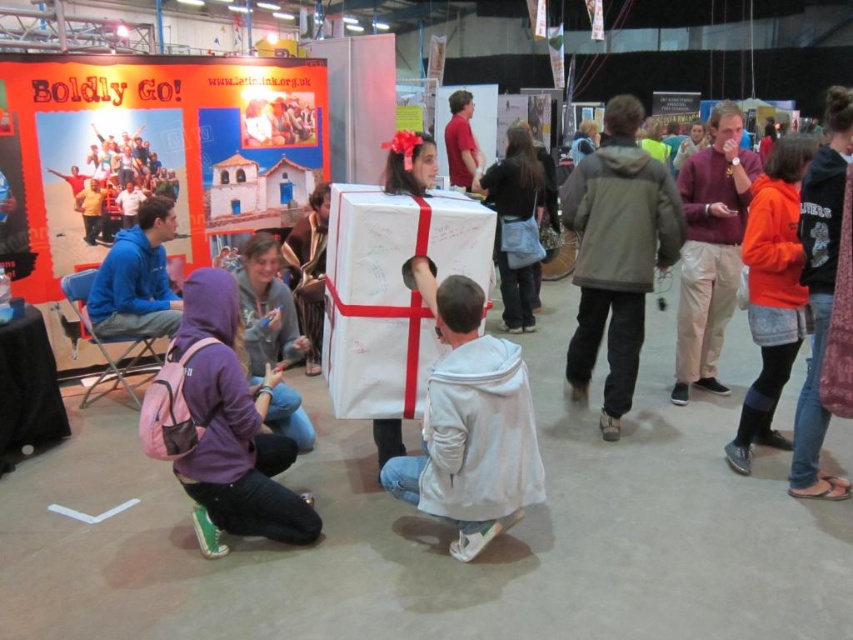
Is orange fleece jacket at right behind matte red shirt at upper center?

No, it is in front of matte red shirt at upper center.

Is point (749, 259) closer to camera compared to point (474, 170)?

Yes, it is.

This screenshot has height=640, width=853. Find the location of `orange fleece jacket at right`. orange fleece jacket at right is located at coordinates (772, 291).

You are a GUI agent. You are given a task and a screenshot of the screen. Output one action in this format:
    pyautogui.click(x=<x>, y=<y>)
    Task: Click on the orange fleece jacket at right
    
    Given the screenshot: What is the action you would take?
    pyautogui.click(x=772, y=291)

Does purple hoodie at lower left have a larger size compared to matte red shirt at upper center?

Yes, purple hoodie at lower left is bigger than matte red shirt at upper center.

Which is more to the left, purple hoodie at lower left or matte red shirt at upper center?

From the viewer's perspective, purple hoodie at lower left appears more on the left side.

What are the coordinates of `purple hoodie at lower left` in the screenshot? It's located at point(222,426).

At what (x,y) coordinates should I click in order to perform the action: click on purple hoodie at lower left. Please return your answer as a coordinate pair (x, y). Looking at the image, I should click on (222, 426).

Does point (608, 336) come farther from viewer compared to point (795, 320)?

Yes, point (608, 336) is behind point (795, 320).

Is gray fabric jacket at center behind orange fleece jacket at right?

Yes, it is.

Which is in front, point (635, 326) or point (753, 324)?

Point (753, 324)

I want to click on gray fabric jacket at center, so click(616, 253).